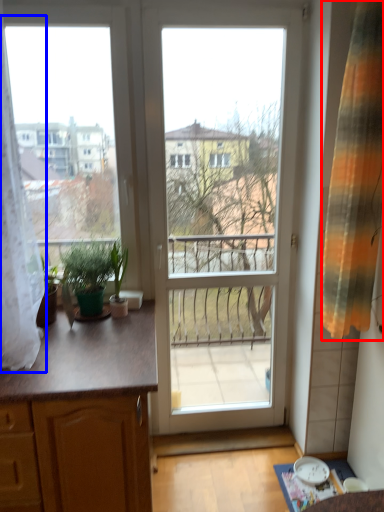
Question: Among these objects, which one is farthest to the camera, curtain (highlighted by a red box) or curtain (highlighted by a blue box)?

Choices:
 (A) curtain
 (B) curtain

Answer: (A)